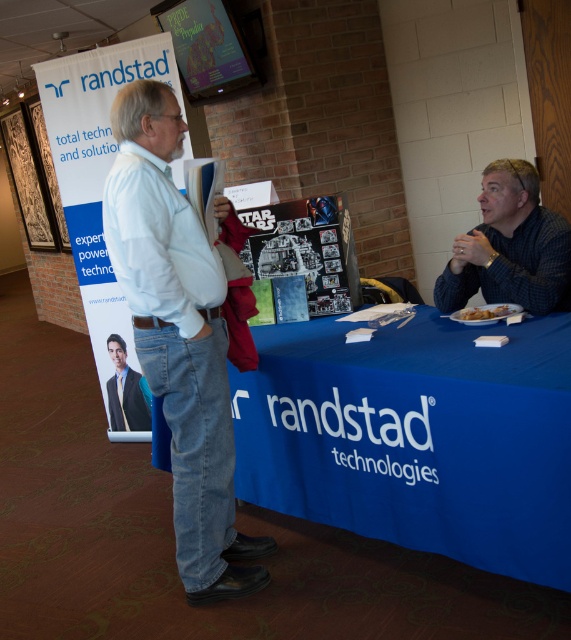
Which is above, blue fabric table at center or white cotton shirt at center?

Positioned higher is white cotton shirt at center.

Does blue fabric table at center have a lesser height compared to white cotton shirt at center?

Indeed, blue fabric table at center has a lesser height compared to white cotton shirt at center.

Is point (528, 362) positioned in front of point (184, 512)?

Yes, it is in front of point (184, 512).

Where is `blue fabric table at center`? blue fabric table at center is located at coordinates (416, 436).

Which is above, blue textured shirt at center or golden crispy hash browns at lower right?

Positioned higher is blue textured shirt at center.

Describe the element at coordinates (509, 248) in the screenshot. This screenshot has height=640, width=571. I see `blue textured shirt at center` at that location.

This screenshot has width=571, height=640. What do you see at coordinates (509, 248) in the screenshot?
I see `blue textured shirt at center` at bounding box center [509, 248].

Where is `blue textured shirt at center`? This screenshot has width=571, height=640. blue textured shirt at center is located at coordinates (509, 248).

Does white cotton shirt at center appear over dark blue suit at center?

Yes, white cotton shirt at center is above dark blue suit at center.

Which is more to the right, white cotton shirt at center or dark blue suit at center?

white cotton shirt at center is more to the right.

I want to click on white cotton shirt at center, so click(178, 339).